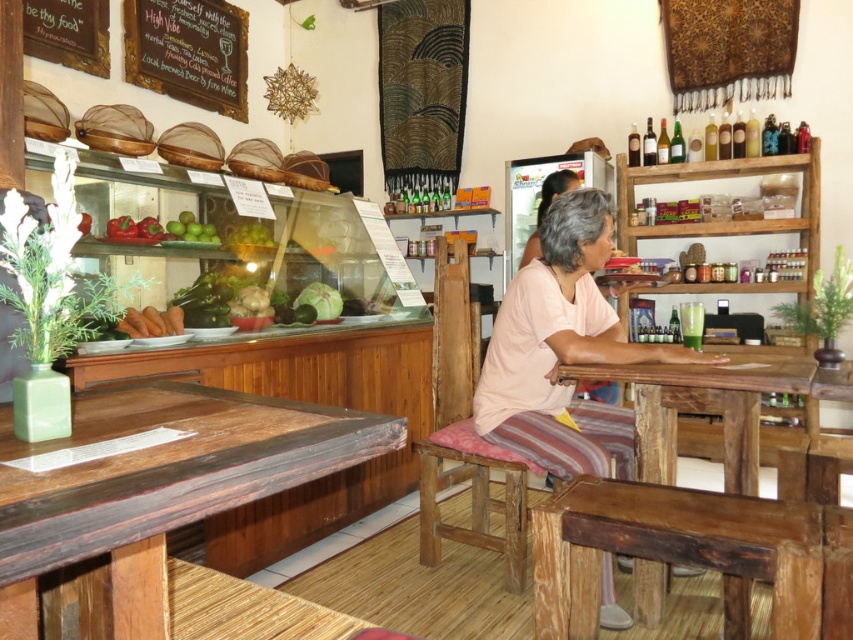
Who is more forward, (564, 392) or (186, 49)?

Point (564, 392) is in front.

Is pink fabric cushion at center below wooden chalkboard at upper left?

Indeed, pink fabric cushion at center is positioned under wooden chalkboard at upper left.

From the picture: Who is more distant from viewer, (556, 387) or (223, 64)?

The point (223, 64) is more distant.

At what (x,y) coordinates should I click in order to perform the action: click on pink fabric cushion at center. Please return your answer as a coordinate pair (x, y). The height and width of the screenshot is (640, 853). Looking at the image, I should click on (563, 349).

Who is shorter, rustic wood table at center or wooden chair at center?

With less height is rustic wood table at center.

Is rustic wood table at center shorter than wooden chair at center?

Yes, rustic wood table at center is shorter than wooden chair at center.

The width and height of the screenshot is (853, 640). Describe the element at coordinates (714, 404) in the screenshot. I see `rustic wood table at center` at that location.

Locate an element on the screen. The width and height of the screenshot is (853, 640). rustic wood table at center is located at coordinates [x=714, y=404].

Is wooden table at center taller than green matte apples at upper center?

Yes, wooden table at center is taller than green matte apples at upper center.

I want to click on wooden table at center, so click(154, 493).

Is point (158, 381) farther from camera compared to point (206, 236)?

No.

What are the coordinates of `wooden table at center` in the screenshot? It's located at (154, 493).